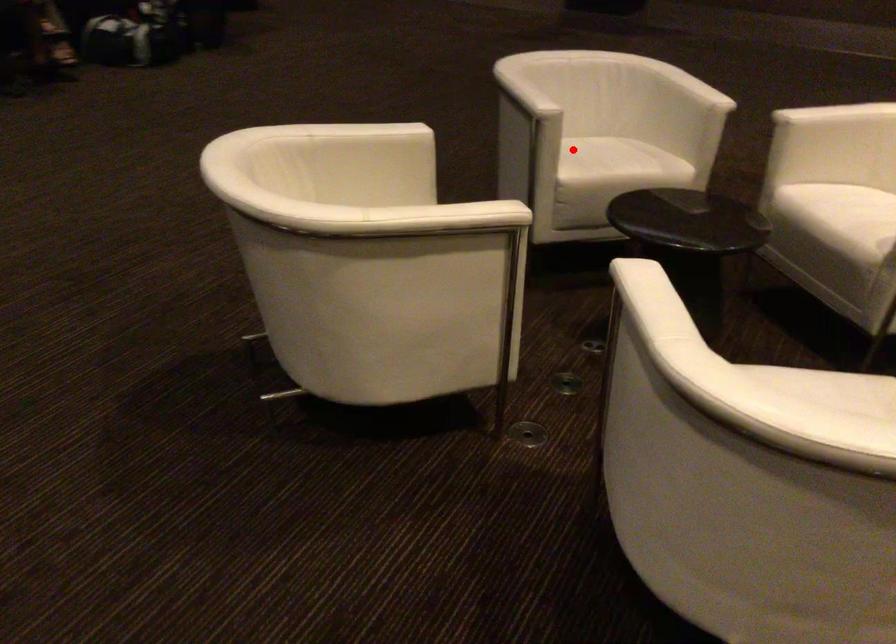
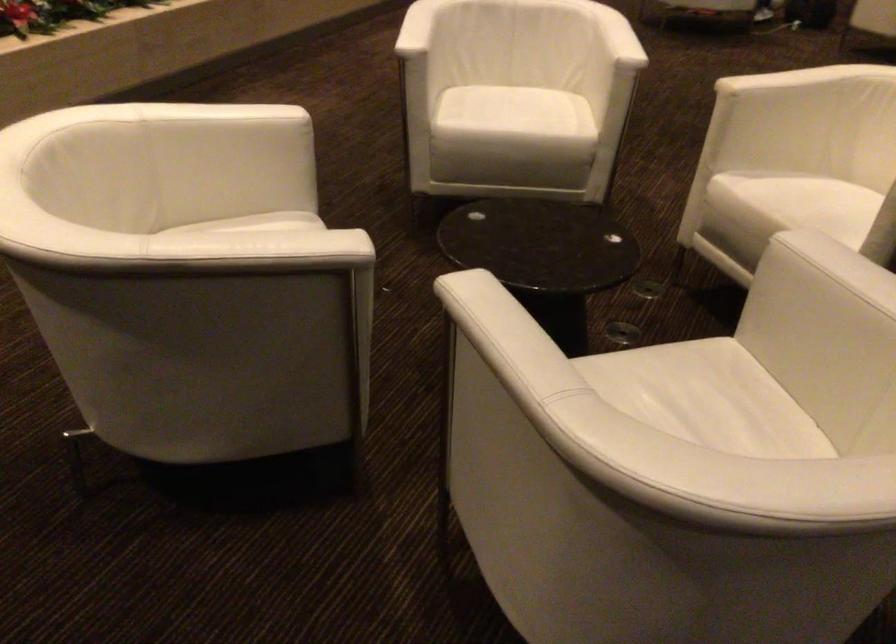
Find the pixel in the second image that matches the highlighted location in the first image.

(686, 388)